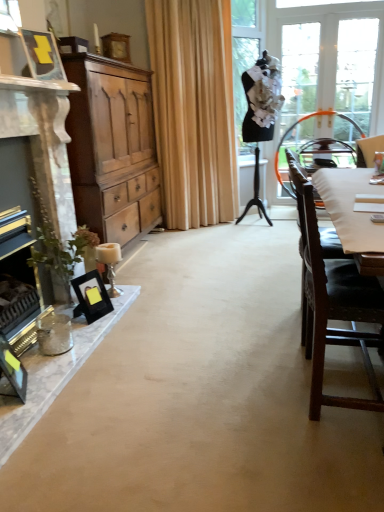
Question: Is the position of beige fabric curtain at center more distant than that of dark brown wood chair at right, which is the second chair from back to front?

Choices:
 (A) yes
 (B) no

Answer: (A)

Question: Considering the relative sizes of beige fabric curtain at center and dark brown wood chair at right, the 1th chair when ordered from front to back, in the image provided, is beige fabric curtain at center taller than dark brown wood chair at right, the 1th chair when ordered from front to back,?

Choices:
 (A) yes
 (B) no

Answer: (A)

Question: Considering the relative positions of beige fabric curtain at center and dark brown wood chair at right, marked as the 1th chair in a left-to-right arrangement, in the image provided, is beige fabric curtain at center to the right of dark brown wood chair at right, marked as the 1th chair in a left-to-right arrangement, from the viewer's perspective?

Choices:
 (A) no
 (B) yes

Answer: (A)

Question: Is beige fabric curtain at center at the left side of dark brown wood chair at right, which is the second chair from back to front?

Choices:
 (A) yes
 (B) no

Answer: (A)

Question: Is the position of beige fabric curtain at center less distant than that of dark brown wood chair at right, which appears as the 1th chair when ordered from the bottom?

Choices:
 (A) yes
 (B) no

Answer: (B)

Question: Is dark brown wood chair at right, the 1th chair when ordered from front to back, bigger or smaller than beige fabric curtain at center?

Choices:
 (A) small
 (B) big

Answer: (A)

Question: Visually, is dark brown wood chair at right, marked as the 1th chair in a left-to-right arrangement, positioned to the left or to the right of beige fabric curtain at center?

Choices:
 (A) right
 (B) left

Answer: (A)

Question: Is dark brown wood chair at right, which appears as the 1th chair when ordered from the bottom, wider or thinner than beige fabric curtain at center?

Choices:
 (A) thin
 (B) wide

Answer: (B)

Question: From a real-world perspective, relative to beige fabric curtain at center, is dark brown wood chair at right, arranged as the 2th chair when viewed from the top, vertically above or below?

Choices:
 (A) below
 (B) above

Answer: (A)

Question: Is matte black picture frame at lower left, which ranks as the 4th picture frame in back-to-front order, taller or shorter than dark brown wood chair at right, the 1th chair when ordered from front to back?

Choices:
 (A) tall
 (B) short

Answer: (B)

Question: Relative to dark brown wood chair at right, the second chair when ordered from right to left, is matte black picture frame at lower left, positioned as the fourth picture frame in top-to-bottom order, in front or behind?

Choices:
 (A) behind
 (B) front

Answer: (A)

Question: From the image's perspective, is matte black picture frame at lower left, positioned as the fourth picture frame in top-to-bottom order, above or below dark brown wood chair at right, arranged as the 2th chair when viewed from the top?

Choices:
 (A) below
 (B) above

Answer: (A)

Question: Would you say matte black picture frame at lower left, which ranks as the 4th picture frame in back-to-front order, is to the left or to the right of dark brown wood chair at right, the 1th chair when ordered from front to back, in the picture?

Choices:
 (A) right
 (B) left

Answer: (B)

Question: Considering the positions of matte brown cabinet at left and matte black picture frame at upper left, which appears as the second picture frame when viewed from the front, in the image, is matte brown cabinet at left wider or thinner than matte black picture frame at upper left, which appears as the second picture frame when viewed from the front,?

Choices:
 (A) wide
 (B) thin

Answer: (A)

Question: Relative to matte black picture frame at upper left, arranged as the 3th picture frame when ordered from the bottom, is matte brown cabinet at left in front or behind?

Choices:
 (A) behind
 (B) front

Answer: (A)